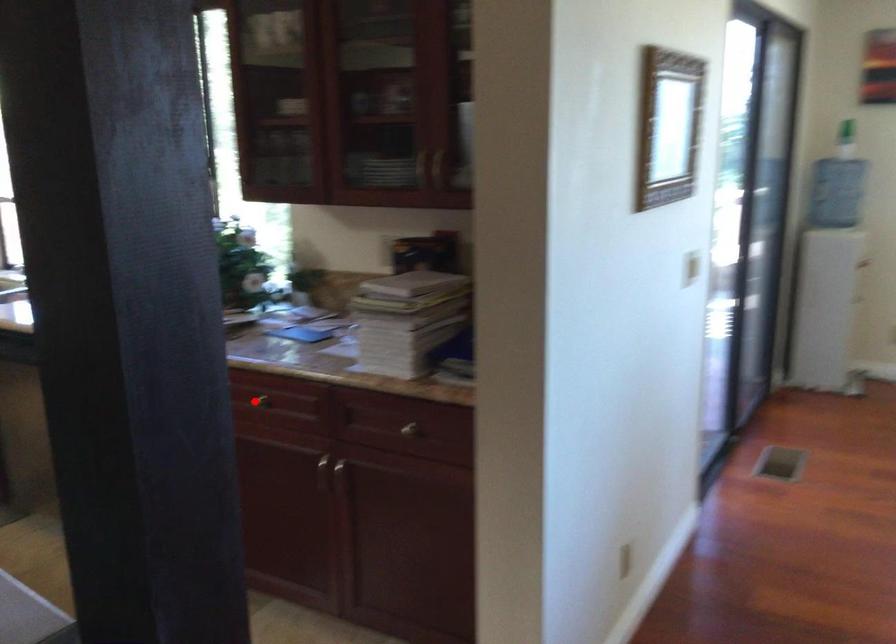
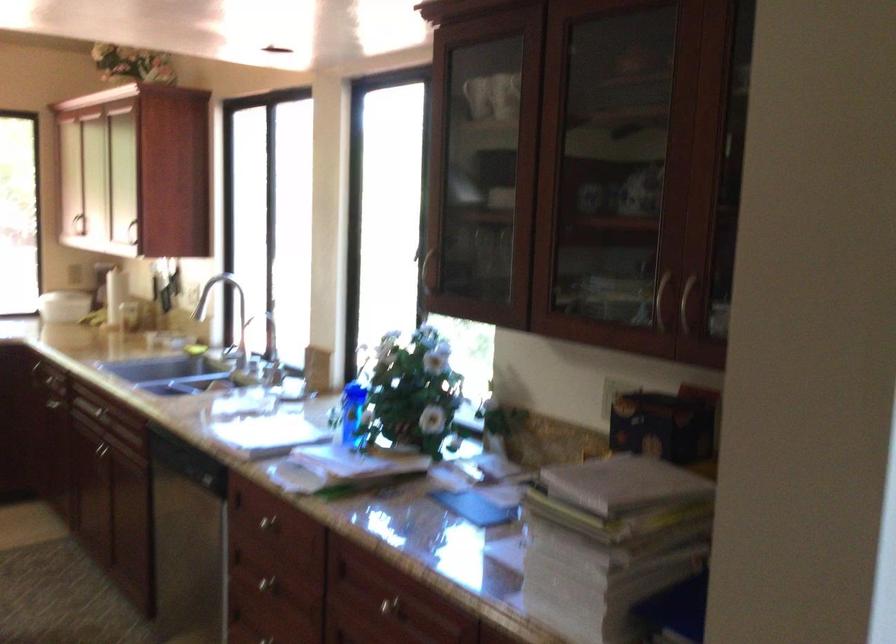
Where in the second image is the point corresponding to the highlighted location from the first image?

(386, 605)